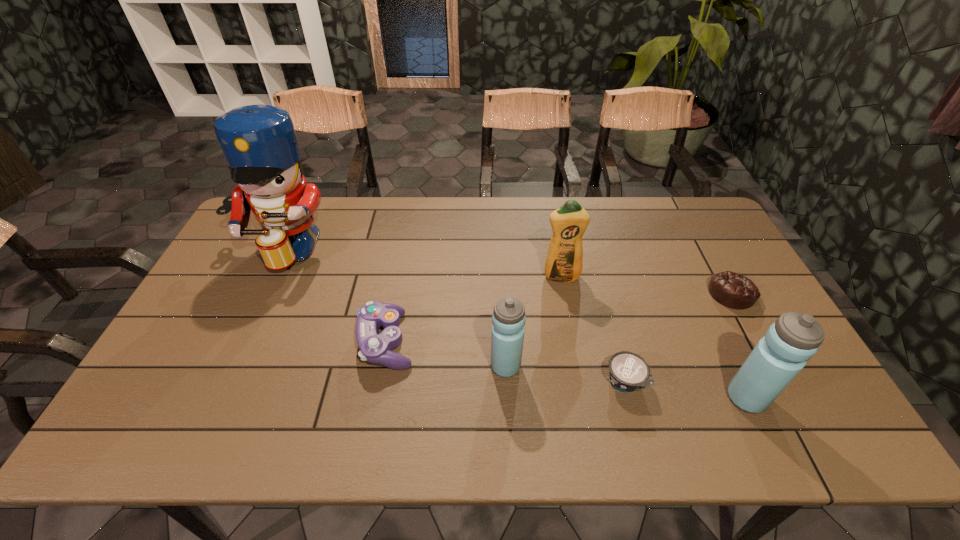
This screenshot has width=960, height=540. What are the coordinates of `the third object from right to left` in the screenshot? It's located at (628, 372).

Where is `blank space located 0.150m on the left of the left water bottle`? The width and height of the screenshot is (960, 540). blank space located 0.150m on the left of the left water bottle is located at coordinates (432, 366).

Locate an element on the screen. free region located on the back of the nearer water bottle is located at coordinates (685, 269).

Locate an element on the screen. The image size is (960, 540). free region located on the label of the detergent is located at coordinates (573, 343).

Locate an element on the screen. vacant region located on the back of the beanbag is located at coordinates (690, 218).

In order to click on vacant space located 0.310m on the back of the fifth tallest object in this screenshot , I will do `click(405, 241)`.

The height and width of the screenshot is (540, 960). I want to click on vacant region located on the front-facing side of the nutcracker, so click(x=219, y=387).

Locate an element on the screen. This screenshot has width=960, height=540. free location located 0.090m on the right of the fifth object from left to right is located at coordinates (681, 381).

Locate an element on the screen. The width and height of the screenshot is (960, 540). object that is positioned at the far edge is located at coordinates (259, 142).

Where is `control positioned at the near edge`? The width and height of the screenshot is (960, 540). control positioned at the near edge is located at coordinates (375, 348).